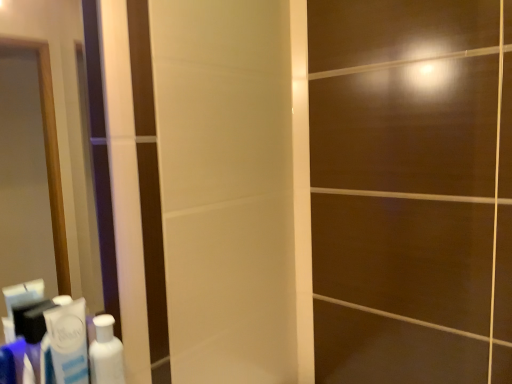
Question: Considering the positions of white glossy bottle at lower left and white glossy toothpaste at lower left in the image, is white glossy bottle at lower left wider or thinner than white glossy toothpaste at lower left?

Choices:
 (A) thin
 (B) wide

Answer: (B)

Question: Is point (121, 349) positioned closer to the camera than point (86, 337)?

Choices:
 (A) farther
 (B) closer

Answer: (A)

Question: Based on their positions, is white glossy bottle at lower left located to the left or right of white glossy toothpaste at lower left?

Choices:
 (A) left
 (B) right

Answer: (B)

Question: Is white glossy toothpaste at lower left inside or outside of white glossy bottle at lower left?

Choices:
 (A) inside
 (B) outside

Answer: (B)

Question: In terms of height, does white glossy toothpaste at lower left look taller or shorter compared to white glossy bottle at lower left?

Choices:
 (A) short
 (B) tall

Answer: (B)

Question: In terms of size, does white glossy toothpaste at lower left appear bigger or smaller than white glossy bottle at lower left?

Choices:
 (A) small
 (B) big

Answer: (B)

Question: From a real-world perspective, relative to white glossy bottle at lower left, is white glossy toothpaste at lower left vertically above or below?

Choices:
 (A) below
 (B) above

Answer: (B)